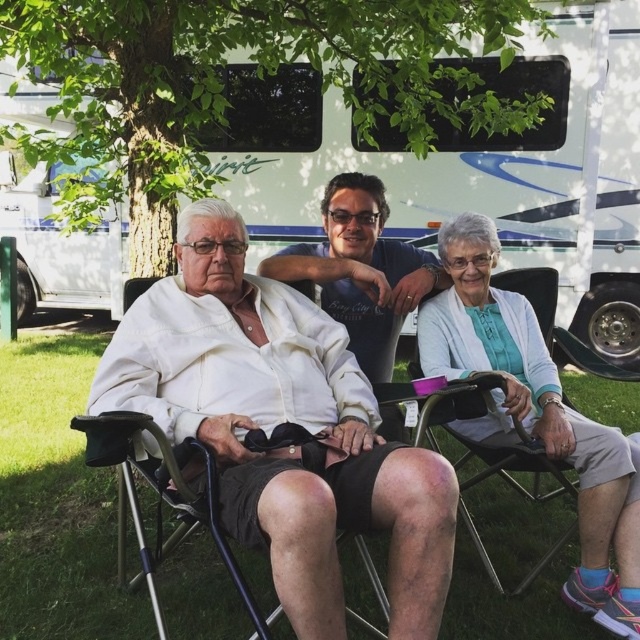
You are standing in the grassy area and want to walk from the white textured cardigan at lower right to the white glossy recreational vehicle at upper center. Which direction should you head?

To go from the white textured cardigan at lower right to the white glossy recreational vehicle at upper center, you should head to the left since the white glossy recreational vehicle at upper center is located to the right of the white textured cardigan at lower right.